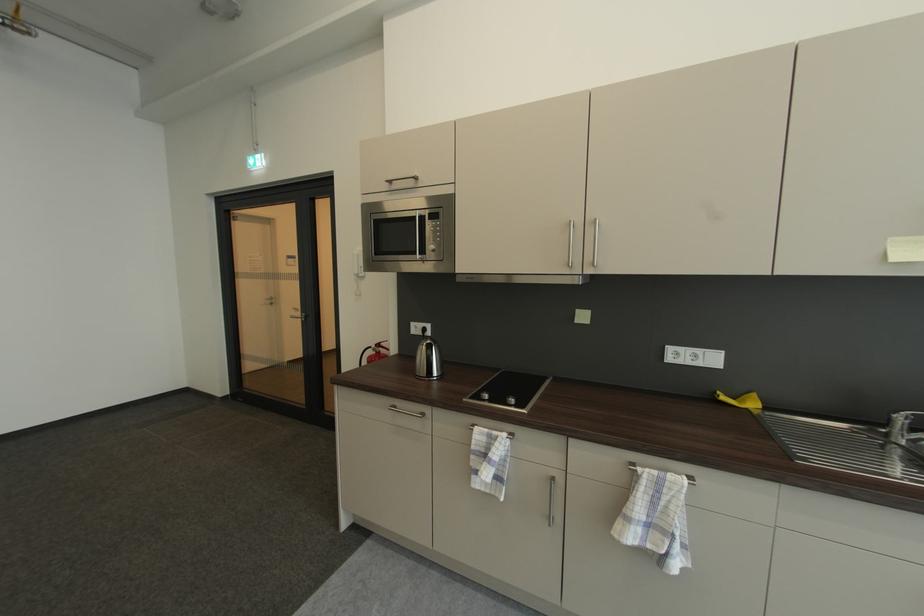
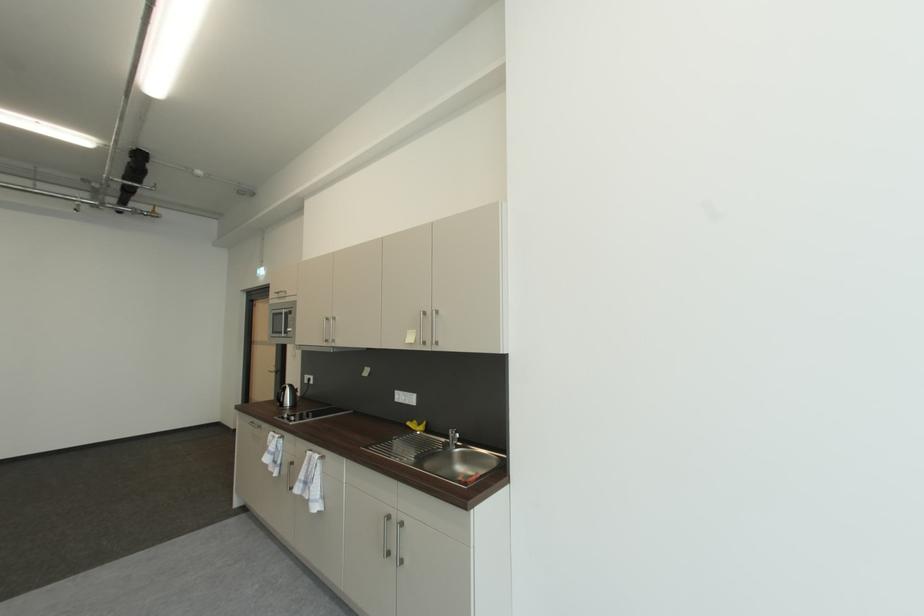
Which direction would the cameraman need to move to produce the second image?

The movement direction of the cameraman is right, backward.